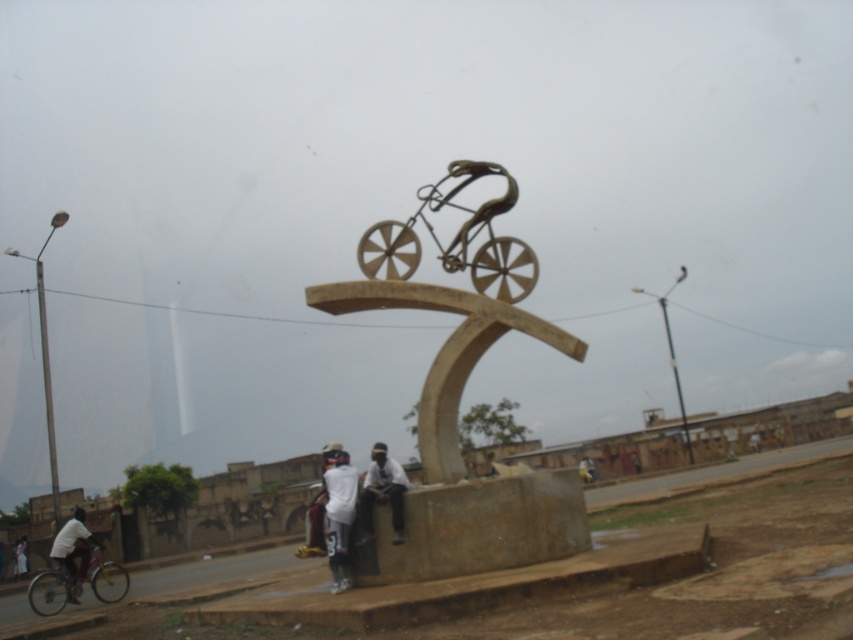
Question: Is bronze bicycle at center below white matte shirt at lower center?

Choices:
 (A) no
 (B) yes

Answer: (A)

Question: Does bronze bicycle at center appear on the right side of white matte shirt at lower center?

Choices:
 (A) yes
 (B) no

Answer: (A)

Question: Which is nearer to the white matte jacket at lower center?

Choices:
 (A) silver metallic bicycle at lower left
 (B) white matte shirt at lower center
 (C) white clothed cyclist at lower left

Answer: (B)

Question: Which object is farther from the camera taking this photo?

Choices:
 (A) white matte jacket at lower center
 (B) bronze bicycle at center

Answer: (A)

Question: Which point is farther to the camera?

Choices:
 (A) (368, 515)
 (B) (76, 554)
 (C) (393, 289)
 (D) (90, 577)

Answer: (B)

Question: Considering the relative positions of silver metallic bicycle at lower left and white matte shirt at lower center in the image provided, where is silver metallic bicycle at lower left located with respect to white matte shirt at lower center?

Choices:
 (A) left
 (B) right

Answer: (A)